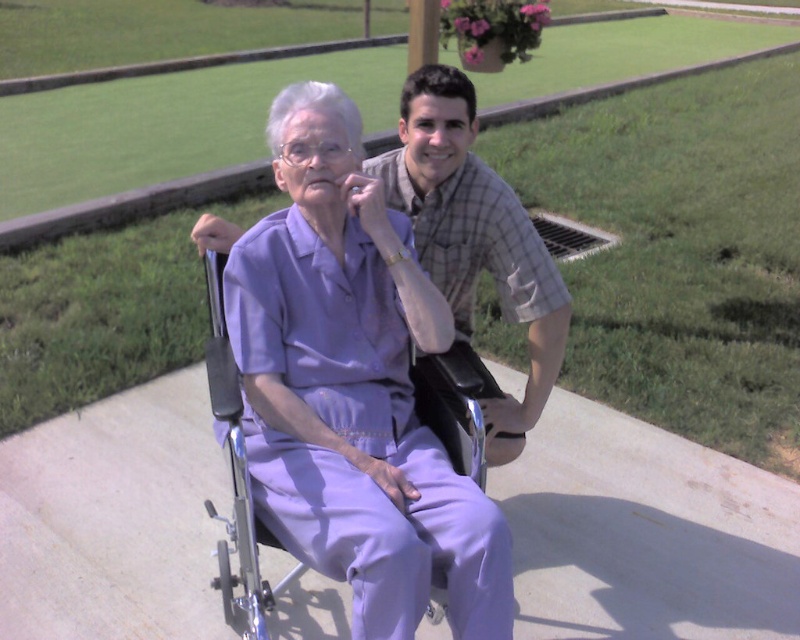
Question: Is plaid cotton shirt at center closer to camera compared to metallic silver wheelchair at center?

Choices:
 (A) no
 (B) yes

Answer: (A)

Question: Is plaid cotton shirt at center wider than metallic silver wheelchair at center?

Choices:
 (A) yes
 (B) no

Answer: (A)

Question: Which point is closer to the camera taking this photo?

Choices:
 (A) (568, 326)
 (B) (470, 410)

Answer: (B)

Question: Considering the relative positions of plaid cotton shirt at center and metallic silver wheelchair at center in the image provided, where is plaid cotton shirt at center located with respect to metallic silver wheelchair at center?

Choices:
 (A) above
 (B) below

Answer: (A)

Question: Which point is closer to the camera?

Choices:
 (A) (230, 612)
 (B) (446, 257)

Answer: (A)